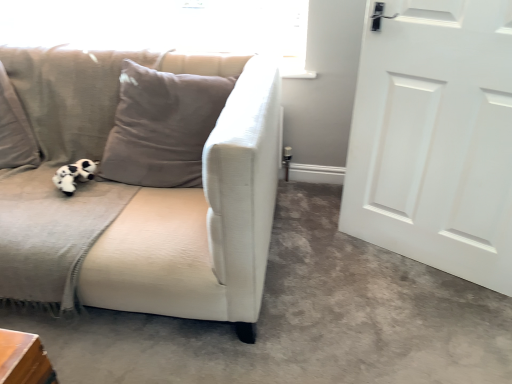
This screenshot has height=384, width=512. I want to click on free space above white fabric couch at left (from a real-world perspective), so click(x=331, y=283).